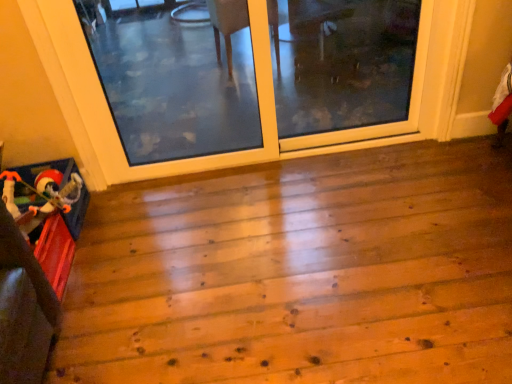
Question: In which direction should I rotate to look at transparent glass screen door at upper center, placed as the second screen door when sorted from left to right?

Choices:
 (A) left
 (B) right

Answer: (B)

Question: Does transparent glass screen door at upper center, placed as the second screen door when sorted from left to right, have a smaller size compared to wooden toy at lower left?

Choices:
 (A) no
 (B) yes

Answer: (A)

Question: Can you confirm if transparent glass screen door at upper center, which is the first screen door in right-to-left order, is shorter than wooden toy at lower left?

Choices:
 (A) yes
 (B) no

Answer: (B)

Question: Is transparent glass screen door at upper center, which is the first screen door in right-to-left order, further to the viewer compared to wooden toy at lower left?

Choices:
 (A) yes
 (B) no

Answer: (A)

Question: From a real-world perspective, is transparent glass screen door at upper center, which is the first screen door in right-to-left order, located higher than wooden toy at lower left?

Choices:
 (A) yes
 (B) no

Answer: (A)

Question: Is transparent glass screen door at upper center, placed as the second screen door when sorted from left to right, aimed at wooden toy at lower left?

Choices:
 (A) yes
 (B) no

Answer: (B)

Question: From the image's perspective, is transparent glass screen door at upper center, which is the first screen door in right-to-left order, on top of wooden toy at lower left?

Choices:
 (A) no
 (B) yes

Answer: (B)

Question: Considering the relative sizes of clear glass screen door at center, the 1th screen door when ordered from left to right, and transparent glass screen door at upper center, which is the first screen door in right-to-left order, in the image provided, is clear glass screen door at center, the 1th screen door when ordered from left to right, taller than transparent glass screen door at upper center, which is the first screen door in right-to-left order,?

Choices:
 (A) yes
 (B) no

Answer: (A)

Question: Is clear glass screen door at center, the 1th screen door when ordered from left to right, located outside transparent glass screen door at upper center, placed as the second screen door when sorted from left to right?

Choices:
 (A) no
 (B) yes

Answer: (B)

Question: Is the depth of clear glass screen door at center, which is counted as the second screen door, starting from the right, greater than that of transparent glass screen door at upper center, which is the first screen door in right-to-left order?

Choices:
 (A) yes
 (B) no

Answer: (B)

Question: Is transparent glass screen door at upper center, placed as the second screen door when sorted from left to right, inside clear glass screen door at center, the 1th screen door when ordered from left to right?

Choices:
 (A) no
 (B) yes

Answer: (B)

Question: Is clear glass screen door at center, which is counted as the second screen door, starting from the right, wider than transparent glass screen door at upper center, placed as the second screen door when sorted from left to right?

Choices:
 (A) yes
 (B) no

Answer: (A)

Question: Is clear glass screen door at center, the 1th screen door when ordered from left to right, far away from transparent glass screen door at upper center, placed as the second screen door when sorted from left to right?

Choices:
 (A) no
 (B) yes

Answer: (A)

Question: Is wooden toy at lower left with clear glass screen door at center, which is counted as the second screen door, starting from the right?

Choices:
 (A) yes
 (B) no

Answer: (B)